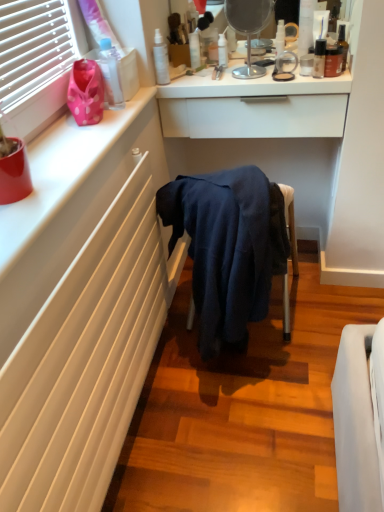
The image size is (384, 512). In order to click on free space to the right of satin white spray bottle at upper center, the 2th toiletry from the left in this screenshot , I will do `click(205, 79)`.